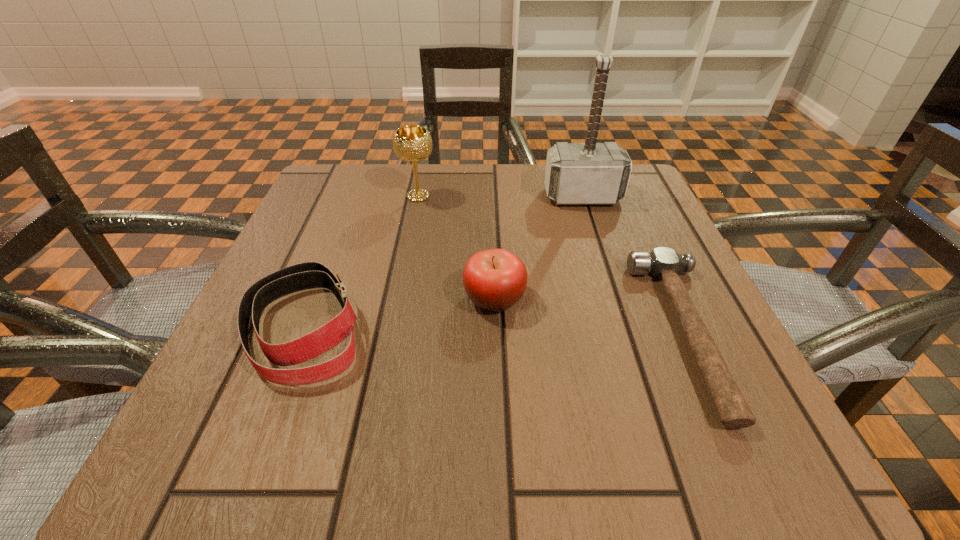
Locate an element on the screen. the tallest object is located at coordinates (590, 173).

Where is `the farther hammer`? the farther hammer is located at coordinates (590, 173).

Locate an element on the screen. The height and width of the screenshot is (540, 960). the fourth shortest object is located at coordinates (412, 143).

Find the location of `chalice`. chalice is located at coordinates (412, 143).

I want to click on the third shortest object, so click(495, 279).

Locate an element on the screen. the third object from right to left is located at coordinates (495, 279).

Locate an element on the screen. The height and width of the screenshot is (540, 960). the fourth tallest object is located at coordinates (307, 275).

Locate an element on the screen. the leftmost object is located at coordinates coord(307,275).

Where is `the nearer hammer`? This screenshot has width=960, height=540. the nearer hammer is located at coordinates (664, 263).

Where is `the shortest object`? This screenshot has height=540, width=960. the shortest object is located at coordinates (664, 263).